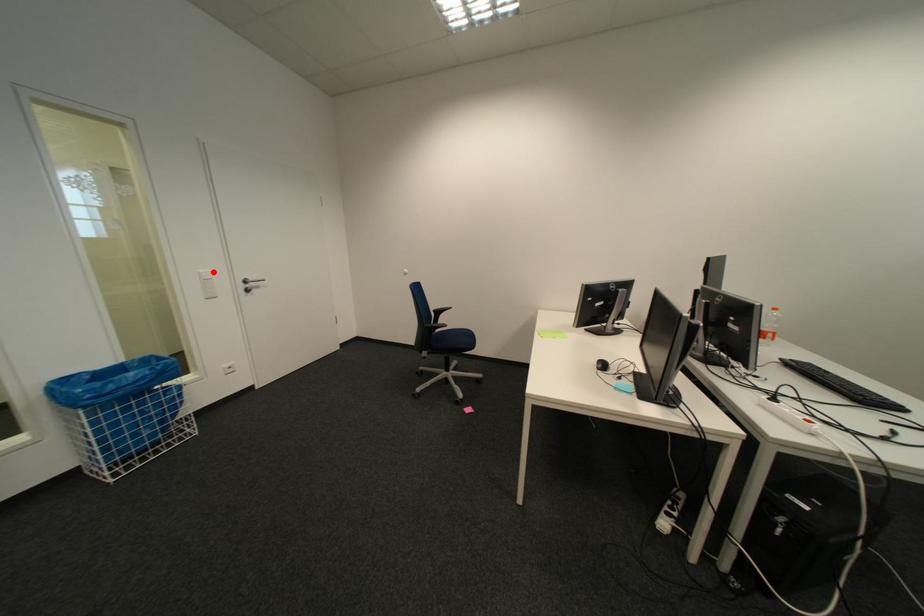
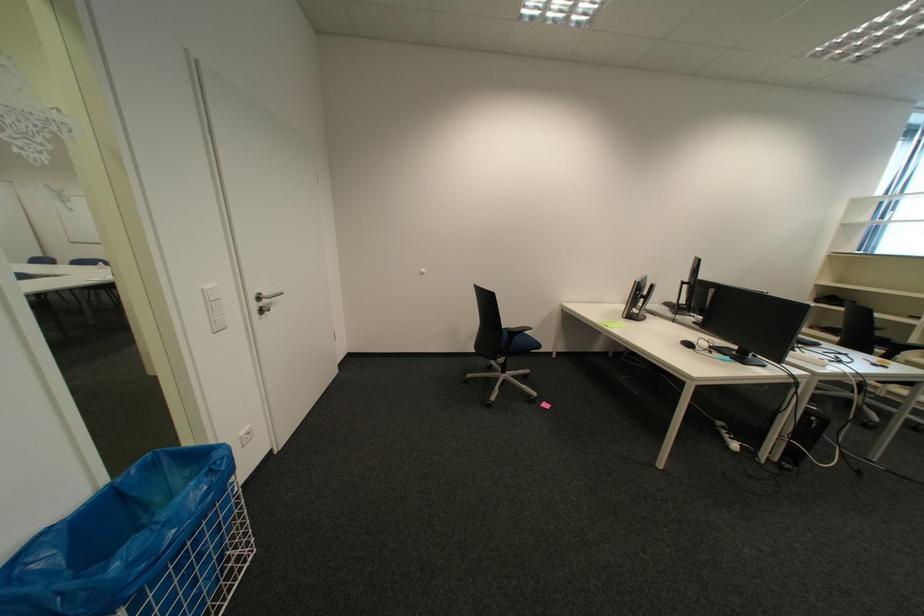
Where in the second image is the point corresponding to the highlighted location from the first image?

(217, 288)